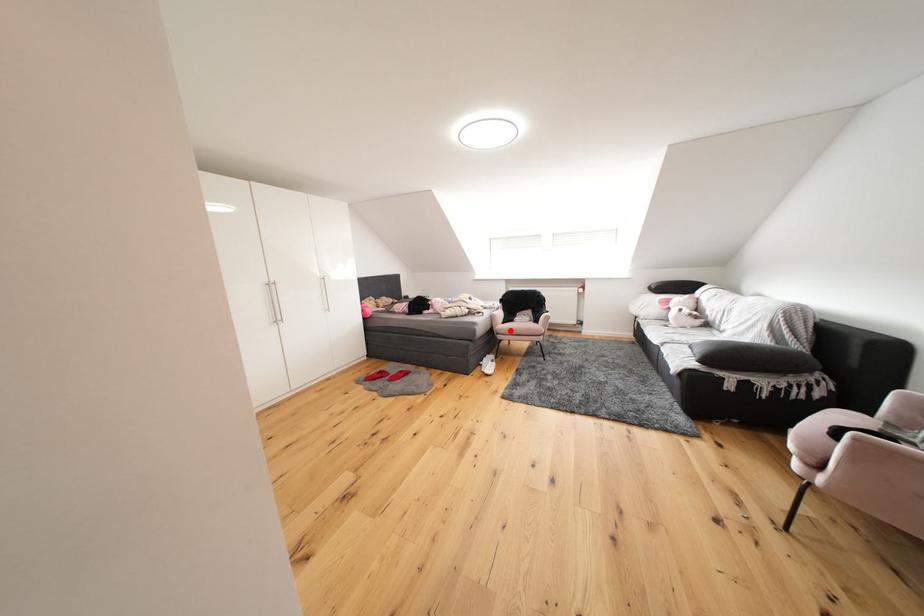
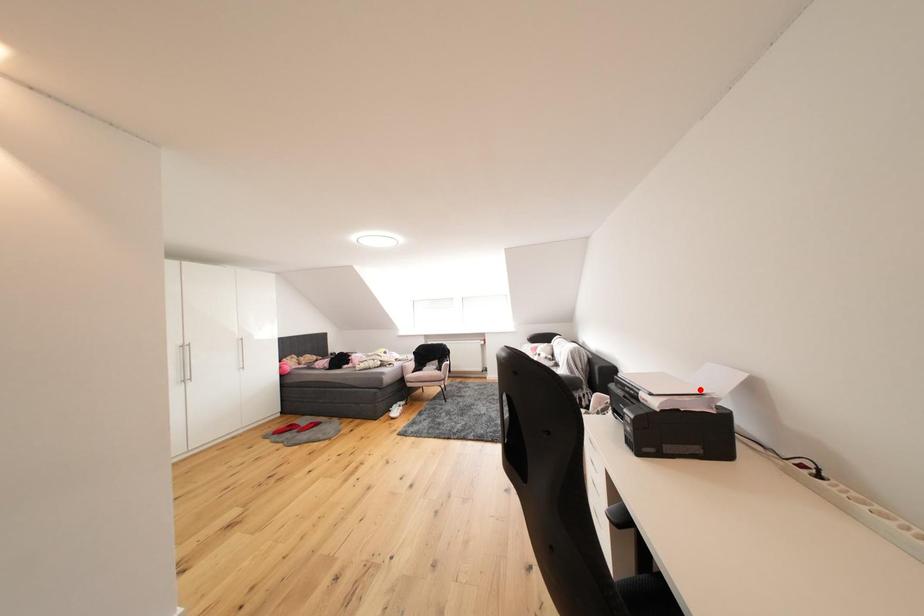
I am providing you with two images of the same scene from different viewpoints. A red point is marked on the first image and another point is marked on the second image. Is the red point in image1 aligned with the point shown in image2?

No